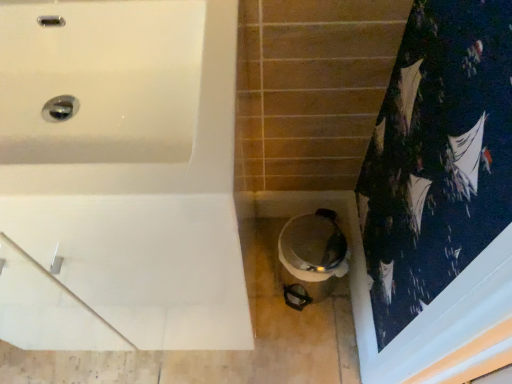
You are a GUI agent. You are given a task and a screenshot of the screen. Output one action in this format:
    pyautogui.click(x=<x>, y=<y>)
    Task: Click on the white glossy bathtub at upper left
    The height and width of the screenshot is (384, 512).
    Given the screenshot: What is the action you would take?
    pyautogui.click(x=129, y=163)

Image resolution: width=512 pixels, height=384 pixels. Describe the element at coordinates (129, 163) in the screenshot. I see `white glossy bathtub at upper left` at that location.

The image size is (512, 384). What do you see at coordinates (313, 247) in the screenshot?
I see `white glossy toilet at lower center` at bounding box center [313, 247].

Find the location of a particular element. white glossy toilet at lower center is located at coordinates (313, 247).

This screenshot has width=512, height=384. I want to click on white glossy bathtub at upper left, so click(x=129, y=163).

Is white glossy toilet at lower center at the right side of white glossy bathtub at upper left?

Yes, white glossy toilet at lower center is to the right of white glossy bathtub at upper left.

Which object is more forward, white glossy toilet at lower center or white glossy bathtub at upper left?

white glossy bathtub at upper left.

Is point (306, 276) less distant than point (11, 265)?

No, (306, 276) is further to viewer.

From the image's perspective, between white glossy toilet at lower center and white glossy bathtub at upper left, who is located below?

white glossy toilet at lower center, from the image's perspective.

From a real-world perspective, which is physically below, white glossy toilet at lower center or white glossy bathtub at upper left?

In real-world perspective, white glossy toilet at lower center is lower.

Is white glossy toilet at lower center wider or thinner than white glossy bathtub at upper left?

white glossy toilet at lower center is thinner than white glossy bathtub at upper left.

Does white glossy toilet at lower center have a greater height compared to white glossy bathtub at upper left?

No, white glossy toilet at lower center is not taller than white glossy bathtub at upper left.

Can you confirm if white glossy toilet at lower center is smaller than white glossy bathtub at upper left?

Correct, white glossy toilet at lower center occupies less space than white glossy bathtub at upper left.

Would you say white glossy toilet at lower center contains white glossy bathtub at upper left?

That's incorrect, white glossy bathtub at upper left is not inside white glossy toilet at lower center.

Are white glossy toilet at lower center and white glossy bathtub at upper left located far from each other?

white glossy toilet at lower center is near white glossy bathtub at upper left, not far away.

Is white glossy toilet at lower center oriented towards white glossy bathtub at upper left?

No, white glossy toilet at lower center is not facing towards white glossy bathtub at upper left.

Looking at this image, measure the distance from white glossy toilet at lower center to white glossy bathtub at upper left.

They are 19.22 inches apart.

You are a GUI agent. You are given a task and a screenshot of the screen. Output one action in this format:
    pyautogui.click(x=<x>, y=<y>)
    Task: Click on the bathtub in front of the white glossy toilet at lower center
    The width and height of the screenshot is (512, 384).
    Given the screenshot: What is the action you would take?
    pyautogui.click(x=129, y=163)

Considering the relative positions of white glossy bathtub at upper left and white glossy toilet at lower center in the image provided, is white glossy bathtub at upper left to the left or to the right of white glossy toilet at lower center?

From the image, it's evident that white glossy bathtub at upper left is to the left of white glossy toilet at lower center.

Considering their positions, is white glossy bathtub at upper left located in front of or behind white glossy toilet at lower center?

white glossy bathtub at upper left is positioned closer to the viewer than white glossy toilet at lower center.

Does point (214, 180) appear closer or farther from the camera than point (318, 280)?

Clearly, point (214, 180) is closer to the camera than point (318, 280).

From the image's perspective, relative to white glossy toilet at lower center, is white glossy bathtub at upper left above or below?

Based on their image positions, white glossy bathtub at upper left is located above white glossy toilet at lower center.

From a real-world perspective, which is physically above, white glossy bathtub at upper left or white glossy toilet at lower center?

From a 3D spatial view, white glossy bathtub at upper left is above.

Between white glossy bathtub at upper left and white glossy toilet at lower center, which one has larger width?

With larger width is white glossy bathtub at upper left.

Is white glossy bathtub at upper left taller or shorter than white glossy toilet at lower center?

white glossy bathtub at upper left is taller than white glossy toilet at lower center.

Considering the relative sizes of white glossy bathtub at upper left and white glossy toilet at lower center in the image provided, is white glossy bathtub at upper left smaller than white glossy toilet at lower center?

Actually, white glossy bathtub at upper left might be larger than white glossy toilet at lower center.

Is white glossy bathtub at upper left outside of white glossy toilet at lower center?

white glossy bathtub at upper left lies outside white glossy toilet at lower center's area.

Does white glossy bathtub at upper left touch white glossy toilet at lower center?

No, white glossy bathtub at upper left is not next to white glossy toilet at lower center.

Is white glossy bathtub at upper left oriented away from white glossy toilet at lower center?

white glossy bathtub at upper left does not have its back to white glossy toilet at lower center.

How different are the orientations of white glossy bathtub at upper left and white glossy toilet at lower center in degrees?

The angle between the facing direction of white glossy bathtub at upper left and the facing direction of white glossy toilet at lower center is 3.17 degrees.

Locate an element on the screen. This screenshot has height=384, width=512. bathtub above the white glossy toilet at lower center (from a real-world perspective) is located at coordinates (129, 163).

Locate an element on the screen. This screenshot has width=512, height=384. bathtub in front of the white glossy toilet at lower center is located at coordinates (129, 163).

In the image, there is a white glossy toilet at lower center. Where is `bathtub above it (from the image's perspective)`? This screenshot has height=384, width=512. bathtub above it (from the image's perspective) is located at coordinates (129, 163).